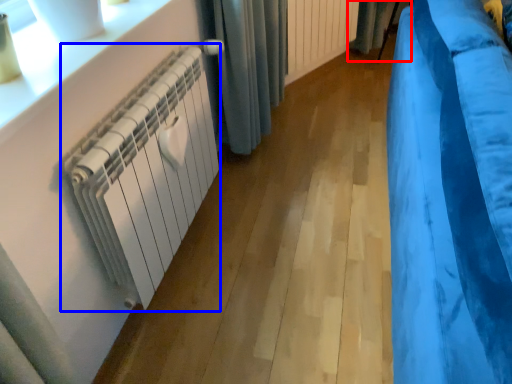
Question: Which object appears farthest to the camera in this image, curtain (highlighted by a red box) or radiator (highlighted by a blue box)?

Choices:
 (A) curtain
 (B) radiator

Answer: (A)